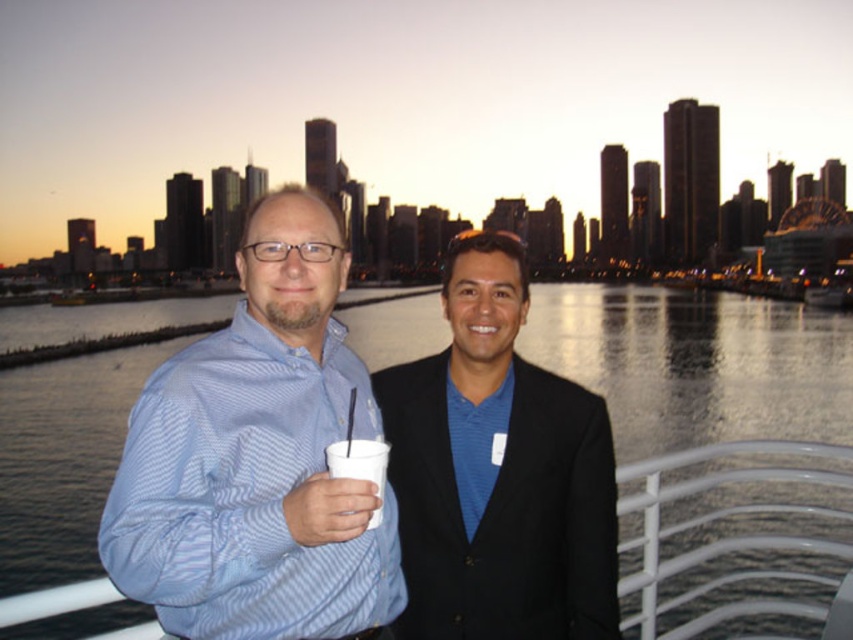
You are a photographer aiming to capture a closeup of the clear water at center without the white paper cup at center obstructing the view. Based on their positions, is this possible?

The clear water at center is closer to the viewer than the white paper cup at center, so the cup would appear behind the water in the photo. Therefore, it won not obstruct the view of the water.

You are a photographer trying to capture the entire scene of the blue striped shirt at center and the clear water at center in a single shot. Given that your camera has a limited field of view, which object should you focus on to ensure both are visible without cropping?

The blue striped shirt at center has a smaller size compared to clear water at center, so focusing on the larger clear water at center will allow both objects to fit within the camera frame.

You are a photographer trying to capture a shot of the clear water at center without including the two people in the background. Based on their positions, can you position yourself in a way to exclude them from the frame?

The clear water at center is located at point (698, 364). Since the two people are standing close together near a railing, positioning yourself directly facing the water at center while angling the camera downward might exclude them from the frame.